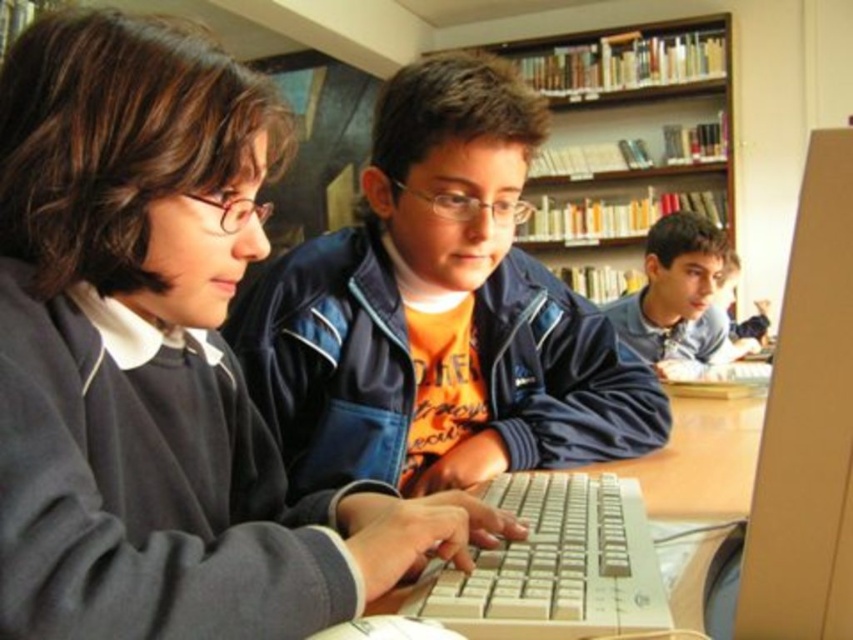
In the scene shown: Can you confirm if blue fabric jacket at center is wider than white plastic keyboard at center?

Indeed, blue fabric jacket at center has a greater width compared to white plastic keyboard at center.

Who is more forward, (x=374, y=396) or (x=636, y=488)?

Positioned in front is point (x=636, y=488).

Which is behind, point (408, 445) or point (624, 605)?

Point (408, 445)

This screenshot has height=640, width=853. In order to click on blue fabric jacket at center in this screenshot , I will do `click(439, 312)`.

Who is higher up, matte plastic monitor at right or white plastic keyboard at center?

matte plastic monitor at right is above.

Does matte plastic monitor at right appear under white plastic keyboard at center?

No, matte plastic monitor at right is not below white plastic keyboard at center.

Describe the element at coordinates (807, 424) in the screenshot. The height and width of the screenshot is (640, 853). I see `matte plastic monitor at right` at that location.

Locate an element on the screen. The image size is (853, 640). matte plastic monitor at right is located at coordinates (807, 424).

Image resolution: width=853 pixels, height=640 pixels. In order to click on wooden bookshelf at upper center in this screenshot , I will do `click(633, 99)`.

How far apart are wooden bookshelf at upper center and blue denim jacket at upper right?

The distance of wooden bookshelf at upper center from blue denim jacket at upper right is 1.93 meters.

Measure the distance between wooden bookshelf at upper center and camera.

A distance of 4.16 meters exists between wooden bookshelf at upper center and camera.

Find the location of a particular element. The height and width of the screenshot is (640, 853). wooden bookshelf at upper center is located at coordinates (633, 99).